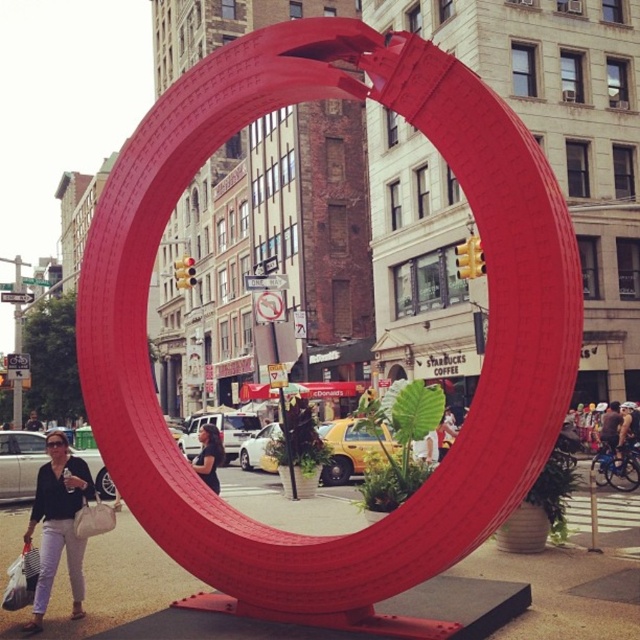
You are a photographer trying to capture both the matte red sculpture at center and the matte black shirt at lower left in a single frame. Which object should you focus on first to ensure both are in the frame?

The matte red sculpture at center is larger in size than the matte black shirt at lower left. To ensure both are in the frame, focus on the larger matte red sculpture at center first, then adjust the camera angle to include the smaller matte black shirt at lower left.

You are standing at the center of the urban scene looking towards the large red sculpture. There are two points marked on the ground in front of you. The first point is at coordinates point (172, 115) and the second is at point (88, 474). Which point is closer to you?

Point (172, 115) is in front of point (88, 474), so the first point is closer to you.

You are a delivery person trying to place both the matte red sculpture at center and the matte black shirt at center into a rectangular box. The box has a width of 1.2 meters. Can you fit both items side by side without overlapping?

The matte red sculpture at center might be wider than the matte black shirt at center. Since the box is 1.2 meters wide, if the combined width of both items exceeds 1.2 meters, they won not fit. However, since the exact width of the sculpture and shirt are unknown, it is uncertain whether they can fit side by side.